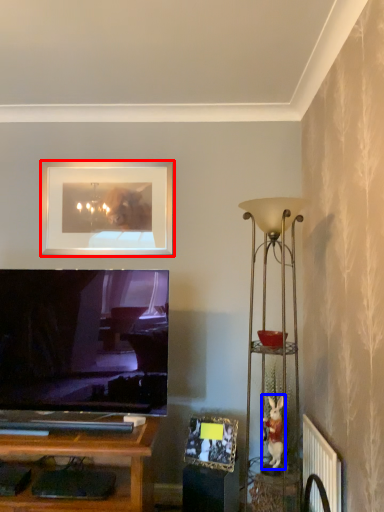
Question: Which point is further to the camera, picture frame (highlighted by a red box) or toy (highlighted by a blue box)?

Choices:
 (A) picture frame
 (B) toy

Answer: (A)